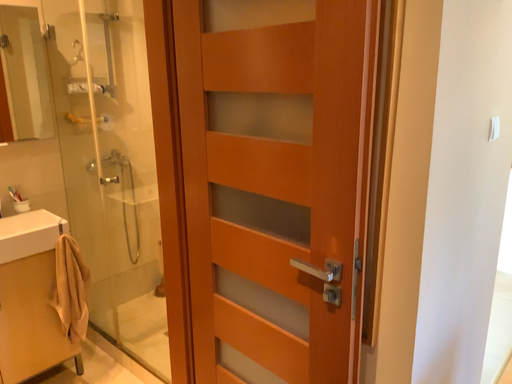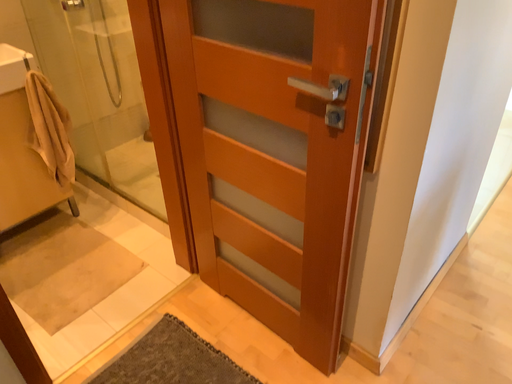
Question: Which way did the camera rotate in the video?

Choices:
 (A) rotated downward
 (B) rotated upward

Answer: (A)